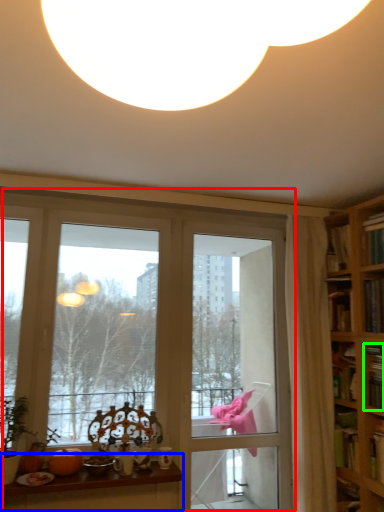
Question: Based on their relative distances, which object is farther from window (highlighted by a red box)? Choose from table (highlighted by a blue box) and book (highlighted by a green box).

Choices:
 (A) table
 (B) book

Answer: (B)